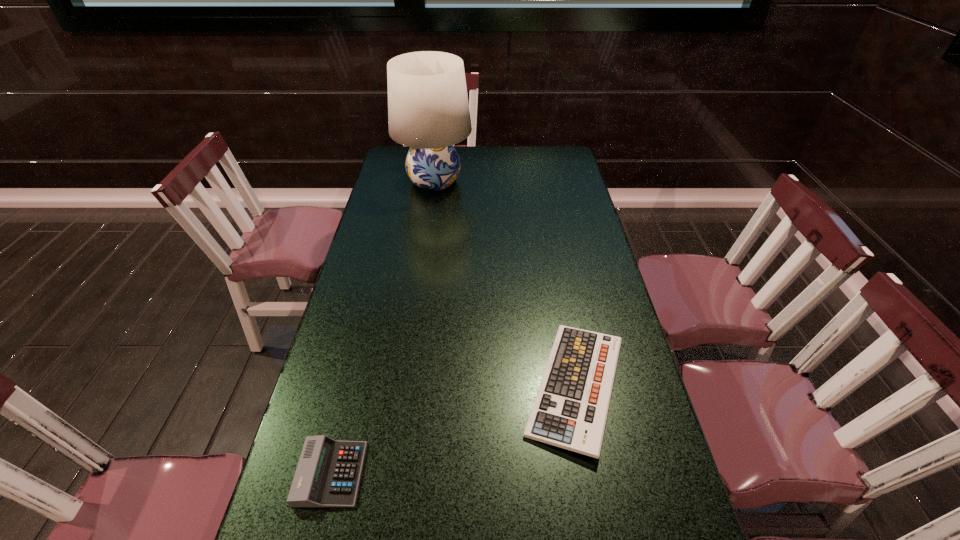
The width and height of the screenshot is (960, 540). I want to click on the tallest object, so click(428, 110).

Identify the location of the farthest object. The image size is (960, 540). (428, 110).

You are a GUI agent. You are given a task and a screenshot of the screen. Output one action in this format:
    pyautogui.click(x=<x>, y=<y>)
    Task: Click on the calculator
    
    Given the screenshot: What is the action you would take?
    pyautogui.click(x=328, y=473)

At what (x,y) coordinates should I click in order to perform the action: click on computer keyboard. Please return your answer as a coordinate pair (x, y). The height and width of the screenshot is (540, 960). Looking at the image, I should click on (570, 410).

In order to click on the rightmost object in this screenshot , I will do `click(570, 410)`.

The width and height of the screenshot is (960, 540). I want to click on vacant area situated 0.330m on the front-facing side of the tallest object, so click(555, 181).

The image size is (960, 540). I want to click on free space located 0.170m on the right of the calculator, so click(x=443, y=474).

The width and height of the screenshot is (960, 540). In order to click on free space located 0.280m on the left of the shortest object in this screenshot , I will do `click(404, 387)`.

What are the coordinates of `object located at the far edge` in the screenshot? It's located at (428, 110).

Locate an element on the screen. Image resolution: width=960 pixels, height=540 pixels. lampshade that is at the left edge is located at coordinates (428, 110).